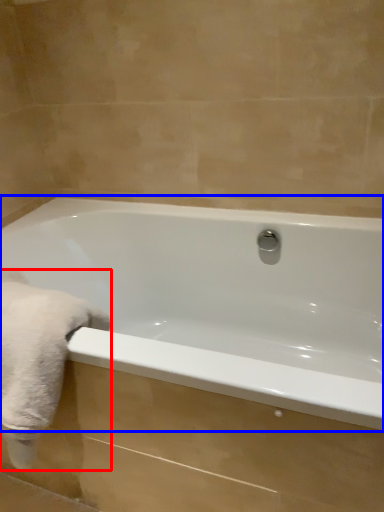
Question: Which object appears farthest to the camera in this image, bath towel (highlighted by a red box) or bathtub (highlighted by a blue box)?

Choices:
 (A) bath towel
 (B) bathtub

Answer: (A)